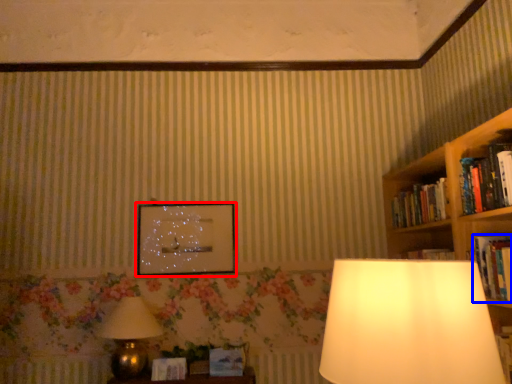
Question: Which point is further to the camera, picture frame (highlighted by a red box) or book (highlighted by a blue box)?

Choices:
 (A) picture frame
 (B) book

Answer: (A)